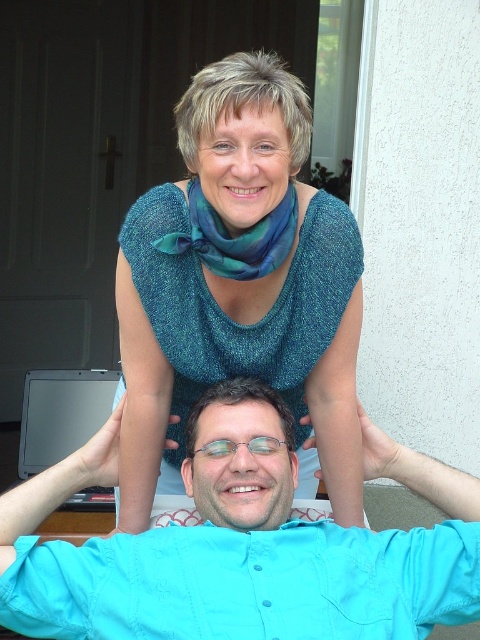
Based on the photo, which is above, teal shimmering blouse at upper center or blue cotton shirt at center?

Positioned higher is teal shimmering blouse at upper center.

Between teal shimmering blouse at upper center and blue cotton shirt at center, which one appears on the right side from the viewer's perspective?

blue cotton shirt at center

Locate an element on the screen. The image size is (480, 640). teal shimmering blouse at upper center is located at coordinates (239, 284).

Can you confirm if teal silk scarf at upper center is smaller than clear plastic glasses at center?

No, teal silk scarf at upper center is not smaller than clear plastic glasses at center.

Which of these two, teal silk scarf at upper center or clear plastic glasses at center, stands shorter?

clear plastic glasses at center

Does point (274, 216) come behind point (210, 445)?

That is False.

Locate an element on the screen. This screenshot has width=480, height=640. teal silk scarf at upper center is located at coordinates pos(235,237).

Is blue cotton shirt at center to the left of teal silk scarf at upper center from the viewer's perspective?

Incorrect, blue cotton shirt at center is not on the left side of teal silk scarf at upper center.

Does blue cotton shirt at center appear on the right side of teal silk scarf at upper center?

Yes, blue cotton shirt at center is to the right of teal silk scarf at upper center.

Who is more forward, (233, 588) or (164, 252)?

Point (233, 588) is in front.

The width and height of the screenshot is (480, 640). Find the location of `blue cotton shirt at center`. blue cotton shirt at center is located at coordinates (240, 557).